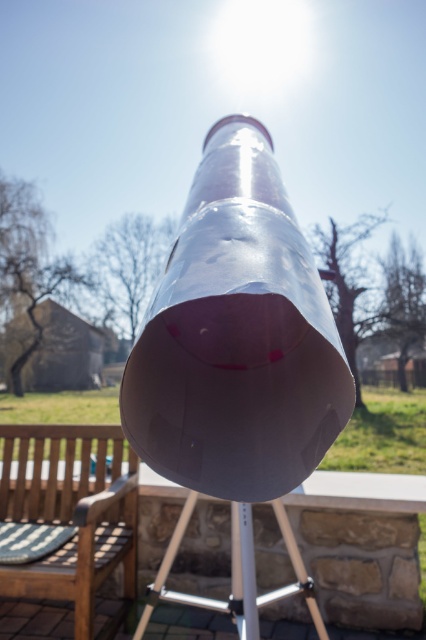
Question: Which object is positioned farthest from the wooden slats bench at lower left?

Choices:
 (A) metallic silver picnic table at center
 (B) glossy metallic telescope at center

Answer: (B)

Question: Is glossy metallic telescope at center below wooden slats bench at lower left?

Choices:
 (A) yes
 (B) no

Answer: (B)

Question: Can you confirm if glossy metallic telescope at center is thinner than wooden slats bench at lower left?

Choices:
 (A) no
 (B) yes

Answer: (B)

Question: Which point appears closest to the camera in this image?

Choices:
 (A) (98, 497)
 (B) (252, 577)

Answer: (B)

Question: Estimate the real-world distances between objects in this image. Which object is closer to the wooden slats bench at lower left?

Choices:
 (A) glossy metallic telescope at center
 (B) metallic silver picnic table at center

Answer: (B)

Question: Does glossy metallic telescope at center come in front of metallic silver picnic table at center?

Choices:
 (A) no
 (B) yes

Answer: (B)